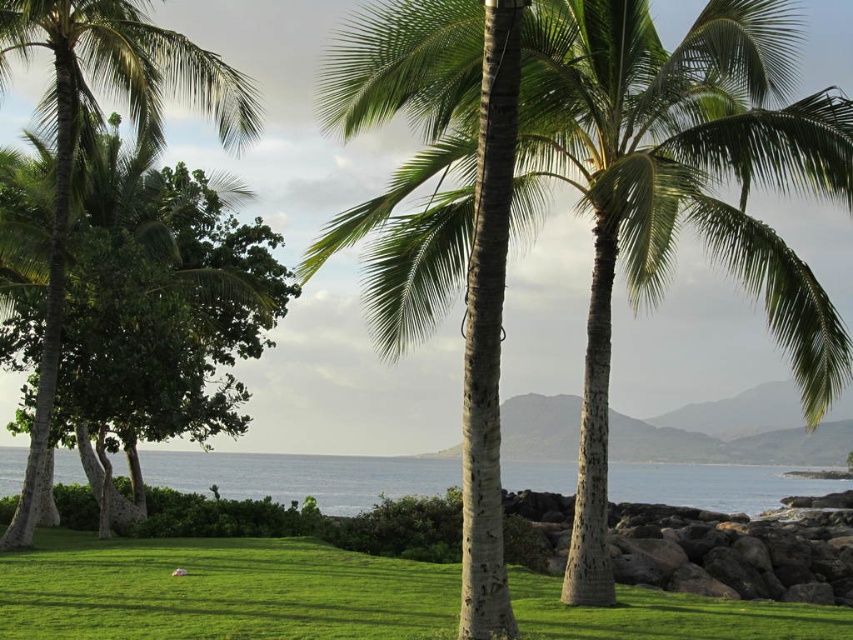
Is point (410, 212) in front of point (711, 630)?

No, (410, 212) is further to viewer.

Which is in front, point (491, 166) or point (158, 556)?

Point (491, 166) is more forward.

Does point (633, 150) come farther from viewer compared to point (218, 586)?

No, (633, 150) is in front of (218, 586).

At what (x,y) coordinates should I click in order to perform the action: click on green leafy coconut trees at center. Please return your answer as a coordinate pair (x, y). The image size is (853, 640). Looking at the image, I should click on (579, 202).

Between green grass at center and green leafy palm tree at left, which one appears on the right side from the viewer's perspective?

Positioned to the right is green grass at center.

Is green grass at center positioned in front of green leafy palm tree at left?

That is True.

I want to click on green grass at center, so click(219, 592).

The width and height of the screenshot is (853, 640). Find the location of `green grass at center`. green grass at center is located at coordinates (219, 592).

Is green leafy coconut trees at center positioned at the back of blue water at center?

No, it is in front of blue water at center.

Does green leafy coconut trees at center have a greater width compared to blue water at center?

No, green leafy coconut trees at center is not wider than blue water at center.

Is point (419, 4) positioned in front of point (637, 486)?

Yes, point (419, 4) is closer to viewer.

This screenshot has width=853, height=640. I want to click on green leafy coconut trees at center, so click(579, 202).